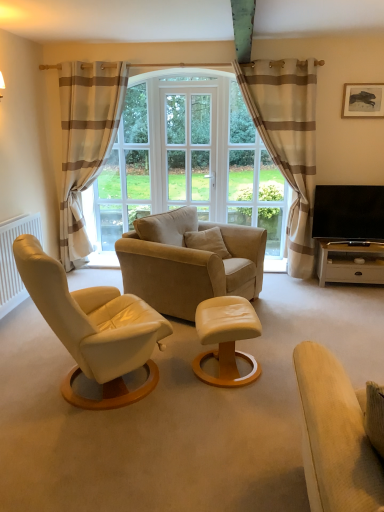
Identify the location of blank area beneath black glossy tv at right (from a real-world perspective). (347, 245).